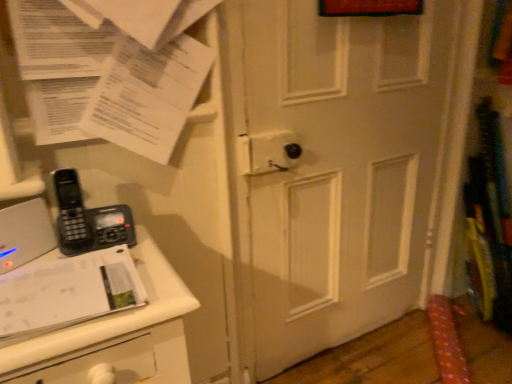
Question: Can you confirm if white matte door at center is wider than black plastic phone at left?

Choices:
 (A) no
 (B) yes

Answer: (B)

Question: Is black plastic phone at left a part of white matte door at center?

Choices:
 (A) no
 (B) yes

Answer: (A)

Question: From the image's perspective, is white matte door at center located beneath black plastic phone at left?

Choices:
 (A) yes
 (B) no

Answer: (B)

Question: Does white matte door at center lie in front of black plastic phone at left?

Choices:
 (A) no
 (B) yes

Answer: (A)

Question: Would you consider white matte door at center to be distant from black plastic phone at left?

Choices:
 (A) yes
 (B) no

Answer: (B)

Question: Is point (65, 289) positioned closer to the camera than point (47, 109)?

Choices:
 (A) closer
 (B) farther

Answer: (A)

Question: Is white glossy journal at lower left to the left or to the right of white paper at upper left in the image?

Choices:
 (A) right
 (B) left

Answer: (B)

Question: From their relative heights in the image, would you say white glossy journal at lower left is taller or shorter than white paper at upper left?

Choices:
 (A) tall
 (B) short

Answer: (B)

Question: From a real-world perspective, is white glossy journal at lower left physically located above or below white paper at upper left?

Choices:
 (A) above
 (B) below

Answer: (B)

Question: From the image's perspective, relative to white plastic changing table at left, is black plastic phone at left above or below?

Choices:
 (A) above
 (B) below

Answer: (A)

Question: From a real-world perspective, is black plastic phone at left above or below white plastic changing table at left?

Choices:
 (A) above
 (B) below

Answer: (A)

Question: Is black plastic phone at left wider or thinner than white plastic changing table at left?

Choices:
 (A) wide
 (B) thin

Answer: (B)

Question: Is black plastic phone at left to the left or to the right of white plastic changing table at left in the image?

Choices:
 (A) right
 (B) left

Answer: (B)

Question: Relative to white paper at upper left, is black plastic phone at left in front or behind?

Choices:
 (A) behind
 (B) front

Answer: (A)

Question: From the image's perspective, relative to white paper at upper left, is black plastic phone at left above or below?

Choices:
 (A) below
 (B) above

Answer: (A)